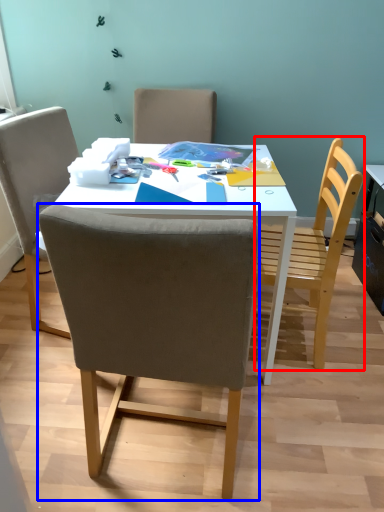
Question: Which of the following is the farthest to the observer, chair (highlighted by a red box) or chair (highlighted by a blue box)?

Choices:
 (A) chair
 (B) chair

Answer: (A)